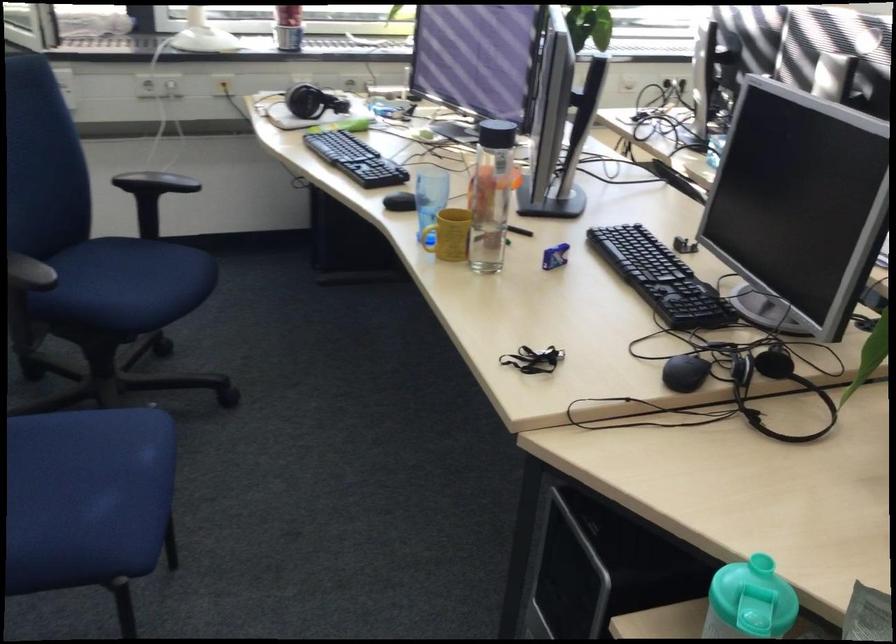
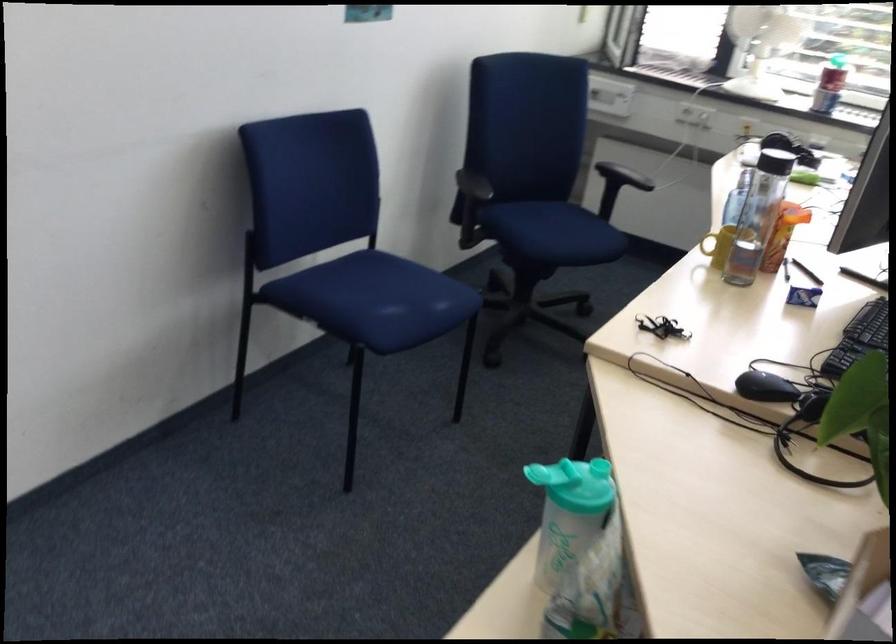
Where in the second image is the point corresponding to [543,254] from the first image?

(803, 297)